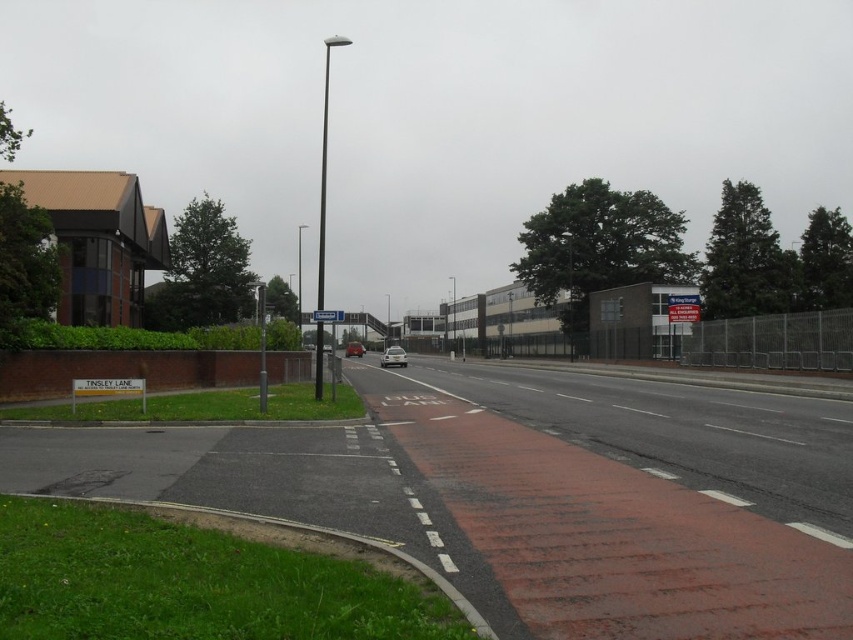
Question: Which object appears closest to the camera in this image?

Choices:
 (A) red brick sidewalk at center
 (B) matte silver car at center

Answer: (A)

Question: Which is nearer to the matte silver car at center?

Choices:
 (A) red brick sidewalk at center
 (B) silver metallic car at center

Answer: (B)

Question: Does red brick sidewalk at center come in front of silver metallic car at center?

Choices:
 (A) no
 (B) yes

Answer: (B)

Question: Is red brick sidewalk at center wider than silver metallic car at center?

Choices:
 (A) yes
 (B) no

Answer: (A)

Question: Which point is closer to the camera?

Choices:
 (A) silver metallic car at center
 (B) matte silver car at center
 (C) red brick sidewalk at center

Answer: (C)

Question: Can you confirm if red brick sidewalk at center is positioned above matte silver car at center?

Choices:
 (A) yes
 (B) no

Answer: (B)